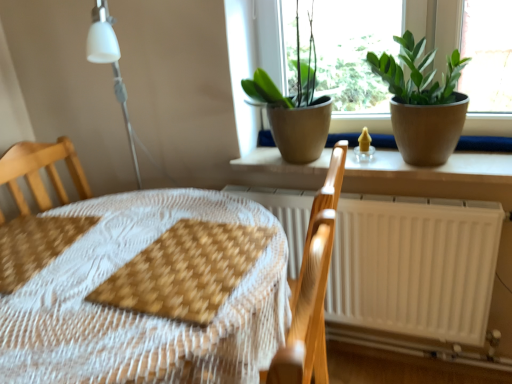
Locate an element on the screen. The image size is (512, 384). vacant space situated above wooden placemat at center (from a real-world perspective) is located at coordinates 102,283.